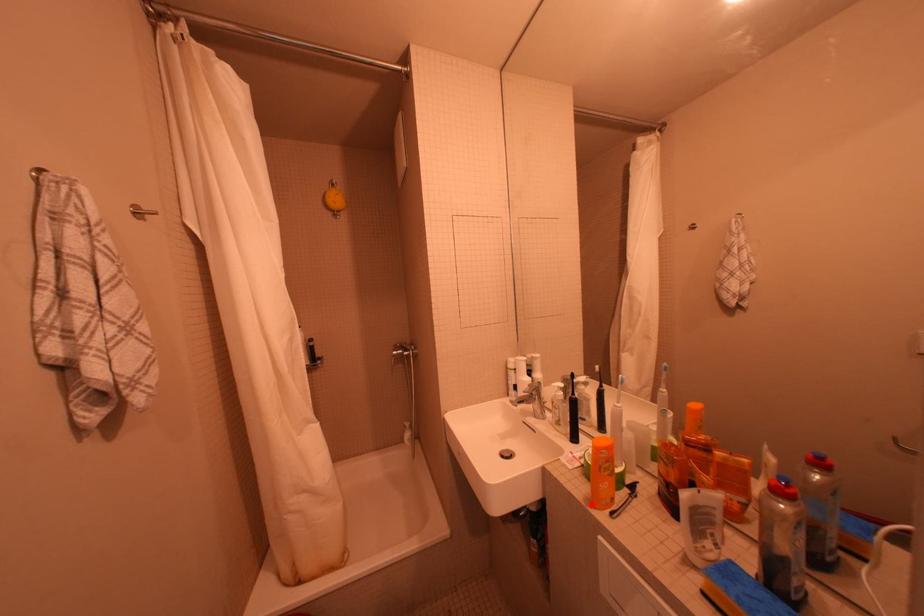
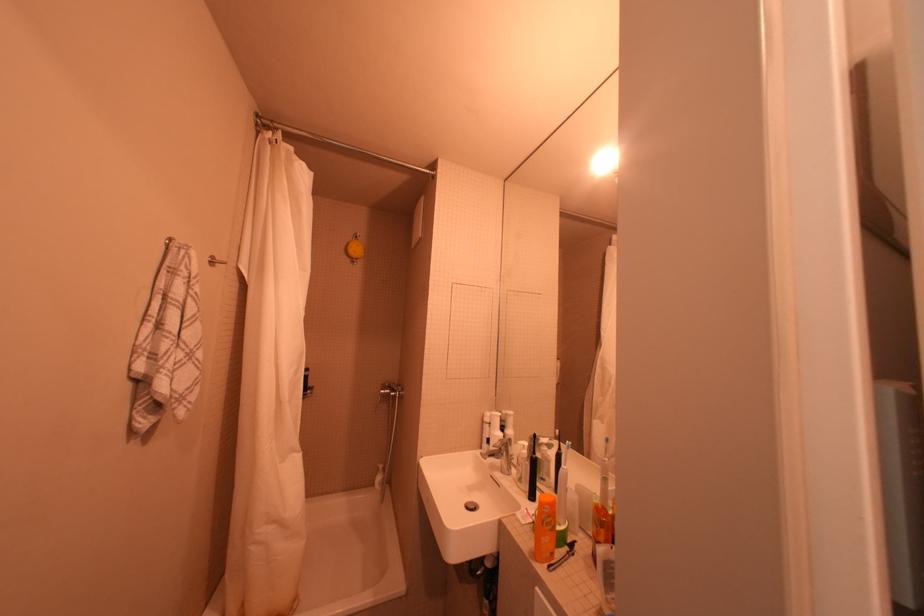
The point at the highlighted location is marked in the first image. Where is the corresponding point in the second image?

(536, 557)